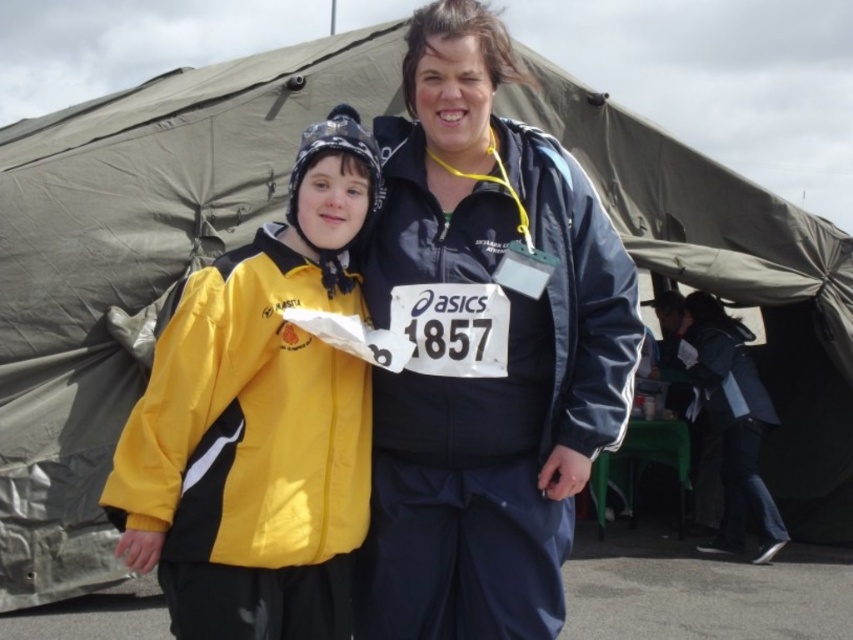
Who is positioned more to the right, matte blue jacket at center or yellow matte jacket at center?

Positioned to the right is matte blue jacket at center.

Does matte blue jacket at center have a greater height compared to yellow matte jacket at center?

Yes, matte blue jacket at center is taller than yellow matte jacket at center.

Is point (403, 300) farther from camera compared to point (258, 424)?

Yes, it is.

This screenshot has height=640, width=853. In order to click on matte blue jacket at center in this screenshot , I will do `click(485, 349)`.